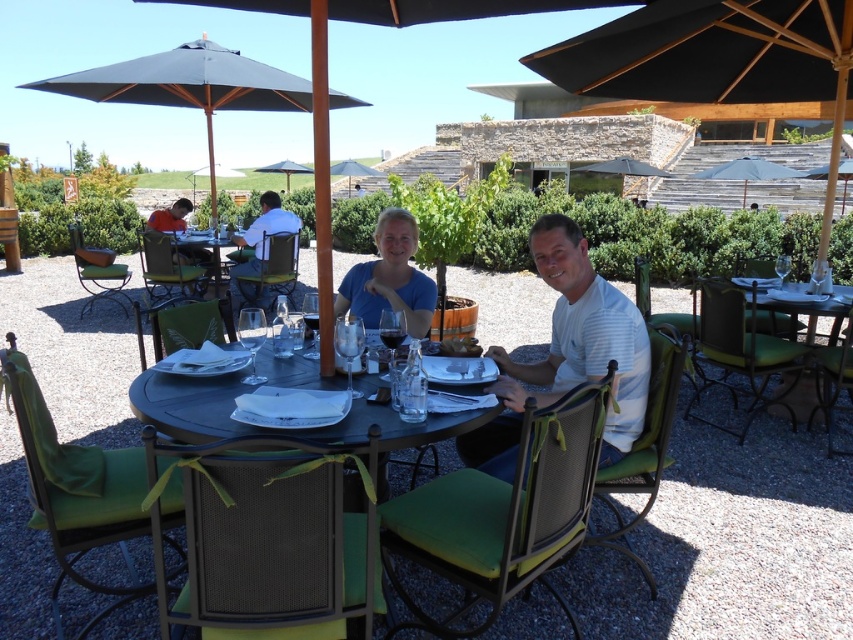
Does blue matte shirt at center appear under teal fabric umbrella at upper center?

Yes, blue matte shirt at center is below teal fabric umbrella at upper center.

Measure the distance between blue matte shirt at center and teal fabric umbrella at upper center.

blue matte shirt at center and teal fabric umbrella at upper center are 13.85 meters apart.

Between point (405, 320) and point (764, 163), which one is positioned behind?

Positioned behind is point (764, 163).

This screenshot has width=853, height=640. Find the location of `blue matte shirt at center`. blue matte shirt at center is located at coordinates (389, 278).

Is white striped shirt at center in front of gray fabric umbrella at upper center?

Yes.

Between point (541, 360) and point (358, 172), which one is positioned behind?

The point (358, 172) is behind.

This screenshot has width=853, height=640. I want to click on white striped shirt at center, so click(567, 353).

Does metallic silver table at center lie behind matte black umbrella at center?

No, it is in front of matte black umbrella at center.

Which is behind, point (206, 241) or point (296, 172)?

Point (296, 172)

Is point (213, 266) closer to viewer compared to point (267, 170)?

That is True.

Where is `metallic silver table at center`? metallic silver table at center is located at coordinates (207, 253).